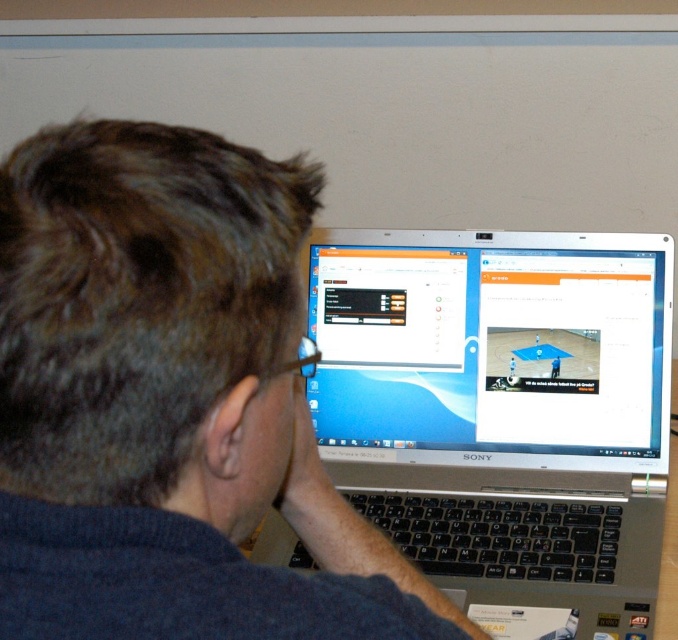
Between point (45, 257) and point (511, 625), which one is positioned behind?

The point (511, 625) is more distant.

Between dark blue sweater at center and silver metallic laptop at center, which one has more height?

silver metallic laptop at center is taller.

Measure the distance between point (x=281, y=182) and camera.

Point (x=281, y=182) and camera are 17.27 inches apart.

Where is `dark blue sweater at center`? The image size is (678, 640). dark blue sweater at center is located at coordinates point(170,401).